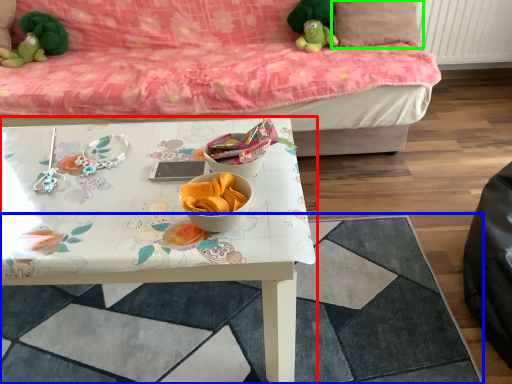
Question: Which object is the farthest from table (highlighted by a red box)? Choose among these: tile (highlighted by a blue box) or pillow (highlighted by a green box).

Choices:
 (A) tile
 (B) pillow

Answer: (B)